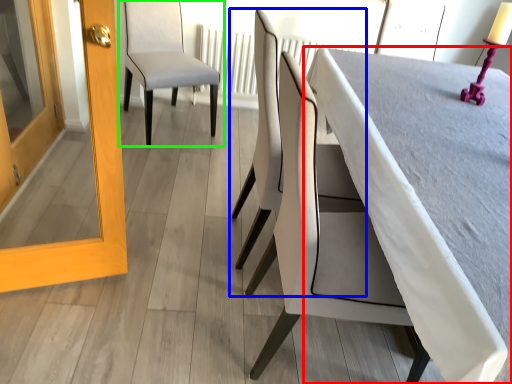
Question: Considering the real-world distances, which object is farthest from table (highlighted by a red box)? chair (highlighted by a blue box) or chair (highlighted by a green box)?

Choices:
 (A) chair
 (B) chair

Answer: (B)